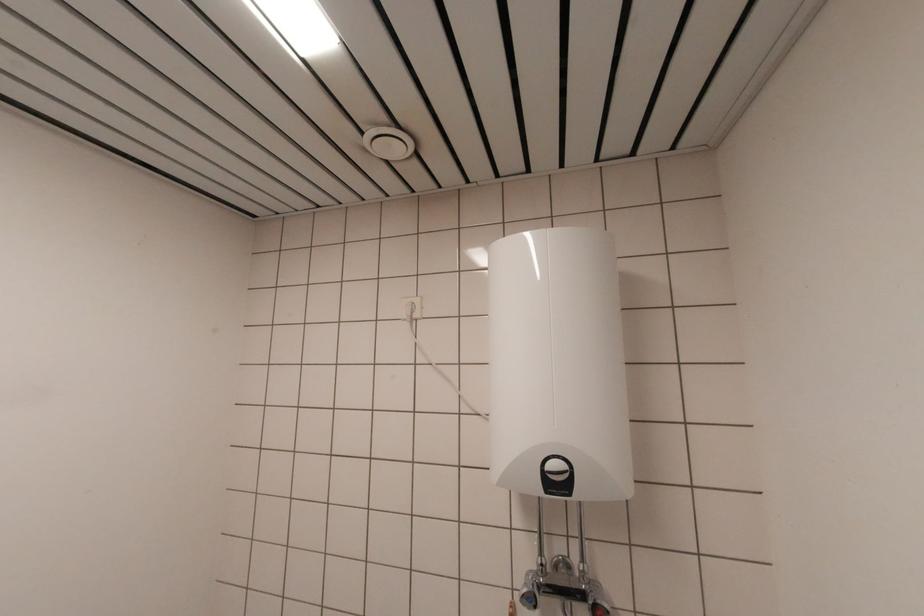
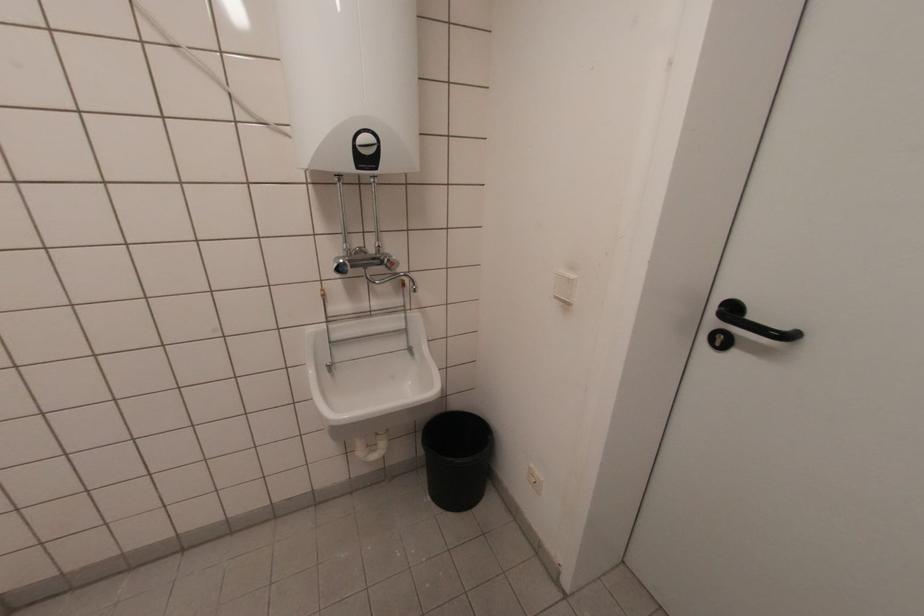
Where in the second image is the point corresponding to (537,570) from the first image?

(343, 254)